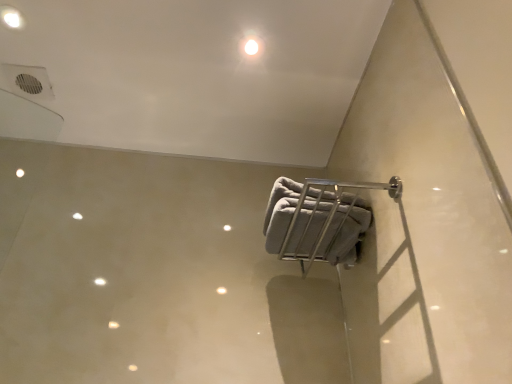
Question: Does white glossy light at upper center, which appears as the 1th dot when ordered from the bottom, appear on the left side of white glossy light fixture at upper left, the 2th dot positioned from the bottom?

Choices:
 (A) yes
 (B) no

Answer: (B)

Question: From a real-world perspective, is white glossy light at upper center, which appears as the first dot when viewed from the right, positioned over white glossy light fixture at upper left, which is the first dot from top to bottom, based on gravity?

Choices:
 (A) yes
 (B) no

Answer: (B)

Question: From a real-world perspective, is white glossy light at upper center, which appears as the first dot when viewed from the right, located beneath white glossy light fixture at upper left, the 2th dot positioned from the bottom?

Choices:
 (A) no
 (B) yes

Answer: (B)

Question: Is white glossy light at upper center, which is the second dot in top-to-bottom order, located outside white glossy light fixture at upper left, the second dot in the right-to-left sequence?

Choices:
 (A) no
 (B) yes

Answer: (B)

Question: Is white glossy light at upper center, which appears as the 1th dot when ordered from the bottom, closer to camera compared to white glossy light fixture at upper left, which is the first dot from top to bottom?

Choices:
 (A) yes
 (B) no

Answer: (B)

Question: Looking at their shapes, would you say gray fabric towel at center-right is wider or thinner than white glossy light at upper center, which appears as the 1th dot when ordered from the bottom?

Choices:
 (A) thin
 (B) wide

Answer: (B)

Question: Visually, is gray fabric towel at center-right positioned to the left or to the right of white glossy light at upper center, which appears as the first dot when viewed from the right?

Choices:
 (A) left
 (B) right

Answer: (B)

Question: In terms of height, does gray fabric towel at center-right look taller or shorter compared to white glossy light at upper center, which appears as the first dot when viewed from the right?

Choices:
 (A) tall
 (B) short

Answer: (A)

Question: Is gray fabric towel at center-right situated inside white glossy light at upper center, which is the second dot in top-to-bottom order, or outside?

Choices:
 (A) inside
 (B) outside

Answer: (B)

Question: Is white glossy light at upper center, the 2th dot from the left, in front of or behind gray fabric towel at center-right in the image?

Choices:
 (A) front
 (B) behind

Answer: (B)

Question: From a real-world perspective, is white glossy light at upper center, which appears as the 1th dot when ordered from the bottom, positioned above or below gray fabric towel at center-right?

Choices:
 (A) above
 (B) below

Answer: (A)

Question: Is white glossy light at upper center, the 2th dot from the left, to the left or to the right of gray fabric towel at center-right in the image?

Choices:
 (A) left
 (B) right

Answer: (A)

Question: From the image's perspective, relative to gray fabric towel at center-right, is white glossy light at upper center, which appears as the 1th dot when ordered from the bottom, above or below?

Choices:
 (A) above
 (B) below

Answer: (A)

Question: Is white glossy light at upper center, which appears as the first dot when viewed from the right, wider or thinner than white glossy light fixture at upper left, which is the first dot from top to bottom?

Choices:
 (A) wide
 (B) thin

Answer: (A)

Question: Would you say white glossy light at upper center, the 2th dot from the left, is to the left or to the right of white glossy light fixture at upper left, the second dot in the right-to-left sequence, in the picture?

Choices:
 (A) left
 (B) right

Answer: (B)